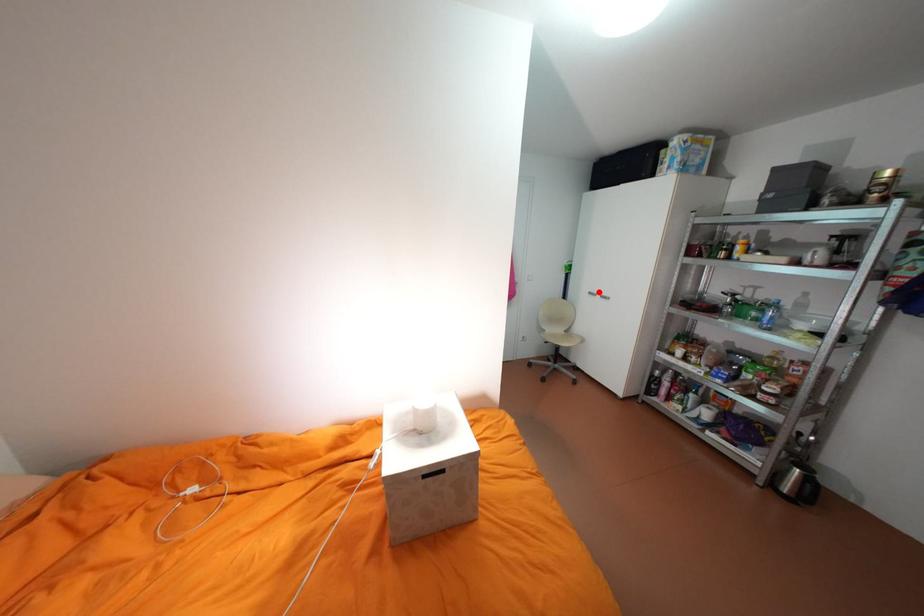
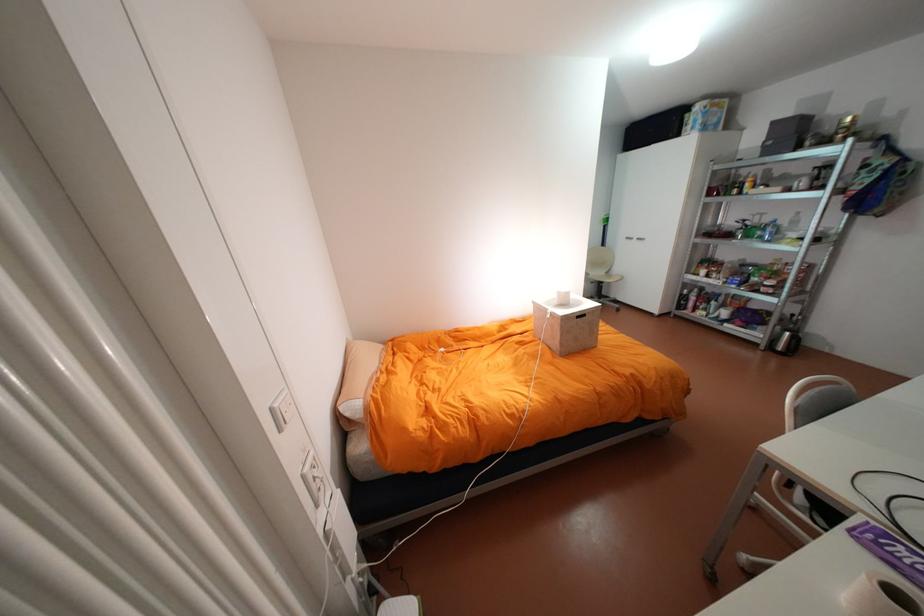
The point at the highlighted location is marked in the first image. Where is the corresponding point in the second image?

(636, 237)